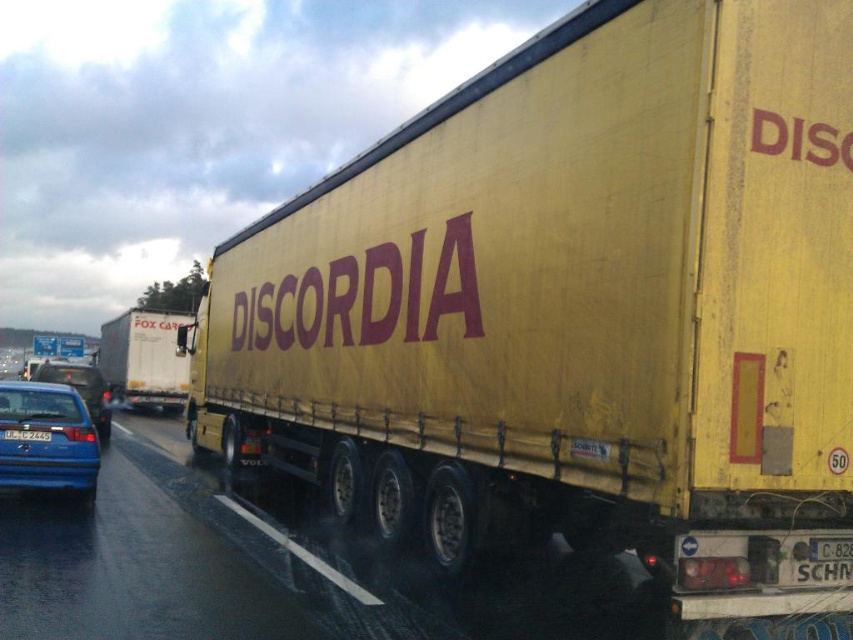
You are a driver approaching the intersection and see a matte blue sedan at left and a white matte truck at left. Which vehicle should you be cautious of overtaking due to its size?

The white matte truck at left is larger than the matte blue sedan at left, so overtaking the white matte truck at left requires more caution due to its size.

You are a pedestrian standing at point (45,438). You see a large yellow truck with red letters and a matte blue sedan. Which vehicle is closer to you?

The matte blue sedan at left is closer to you because it is located at point (45,438) where you are standing.

You are a delivery driver who needs to pass a matte blue sedan at left and a white matte truck at left on a narrow road. Given that the road is only wide enough for one vehicle, which vehicle should you attempt to pass first?

The matte blue sedan at left has a lesser width compared to the white matte truck at left, so you should attempt to pass the matte blue sedan at left first since it requires less space to maneuver around.